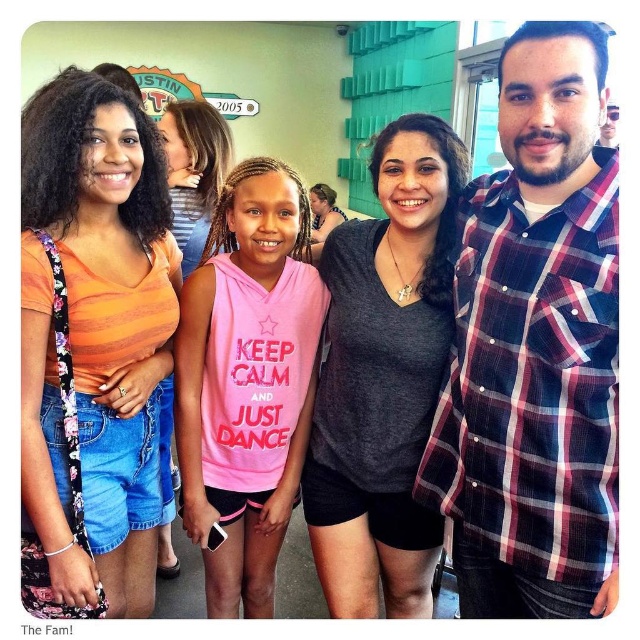
Is plaid shirt at right wider than pink cotton hoodie at center?

Correct, the width of plaid shirt at right exceeds that of pink cotton hoodie at center.

Which is above, plaid shirt at right or pink cotton hoodie at center?

Positioned higher is pink cotton hoodie at center.

Between point (538, 273) and point (172, 118), which one is positioned behind?

Point (172, 118)

Where is `plaid shirt at right`? This screenshot has width=640, height=640. plaid shirt at right is located at coordinates (536, 348).

Is point (86, 108) behind point (170, 164)?

No.

Is orange cotton tank top at left taller than pink cotton hoodie at center?

Correct, orange cotton tank top at left is much taller as pink cotton hoodie at center.

Where is `orange cotton tank top at left`? orange cotton tank top at left is located at coordinates (92, 344).

Looking at this image, measure the distance between plaid shirt at right and pink sleeveless hoodie at center.

plaid shirt at right and pink sleeveless hoodie at center are 58.20 centimeters apart from each other.

Between point (598, 168) and point (195, 477), which one is positioned in front?

Point (598, 168) is more forward.

Between point (465, 307) and point (276, 273), which one is positioned in front?

Point (465, 307) is more forward.

I want to click on plaid shirt at right, so coord(536,348).